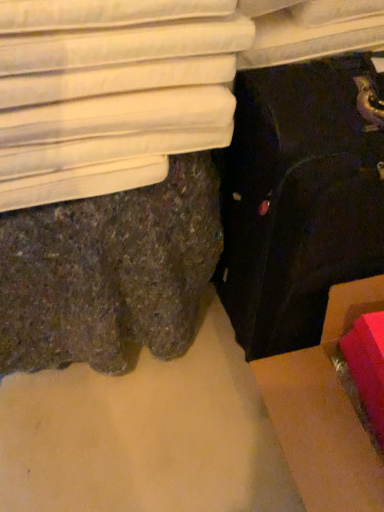
What do you see at coordinates (142, 82) in the screenshot? I see `white fabric bed at upper left` at bounding box center [142, 82].

What are the coordinates of `black fabric suitcase at lower right` in the screenshot? It's located at click(x=298, y=200).

Is white fabric bed at upper left facing away from black fabric suitcase at lower right?

That's not correct — white fabric bed at upper left is not looking away from black fabric suitcase at lower right.

Considering the relative sizes of white fabric bed at upper left and black fabric suitcase at lower right in the image provided, is white fabric bed at upper left smaller than black fabric suitcase at lower right?

Correct, white fabric bed at upper left occupies less space than black fabric suitcase at lower right.

From a real-world perspective, is white fabric bed at upper left above or below black fabric suitcase at lower right?

From a real-world perspective, white fabric bed at upper left is physically above black fabric suitcase at lower right.

Which is behind, white fabric bed at upper left or black fabric suitcase at lower right?

white fabric bed at upper left is more distant.

Based on the photo, is black fabric suitcase at lower right wider or thinner than white fabric bed at upper left?

black fabric suitcase at lower right is thinner than white fabric bed at upper left.

Find the location of a particular element. furniture that is above the black fabric suitcase at lower right (from the image's perspective) is located at coordinates (142, 82).

Consider the image. How different are the orientations of black fabric suitcase at lower right and white fabric bed at upper left in degrees?

The facing directions of black fabric suitcase at lower right and white fabric bed at upper left are 0.618 degrees apart.

Looking at this image, is black fabric suitcase at lower right in front of or behind white fabric bed at upper left in the image?

Clearly, black fabric suitcase at lower right is in front of white fabric bed at upper left.

Based on their sizes in the image, would you say cardboard box at lower right is bigger or smaller than black fabric suitcase at lower right?

In the image, cardboard box at lower right appears to be smaller than black fabric suitcase at lower right.

Which object is further away from the camera, cardboard box at lower right or black fabric suitcase at lower right?

cardboard box at lower right is more distant.

Considering the points (342, 504) and (296, 314), which point is in front, point (342, 504) or point (296, 314)?

The point (342, 504) is closer.

How distant is cardboard box at lower right from black fabric suitcase at lower right?

The distance of cardboard box at lower right from black fabric suitcase at lower right is 8.61 inches.

From the image's perspective, is black fabric suitcase at lower right on cardboard box at lower right?

Correct, black fabric suitcase at lower right appears higher than cardboard box at lower right in the image.

Does black fabric suitcase at lower right have a smaller size compared to cardboard box at lower right?

Incorrect, black fabric suitcase at lower right is not smaller in size than cardboard box at lower right.

From the picture: Would you say black fabric suitcase at lower right is outside cardboard box at lower right?

That's correct, black fabric suitcase at lower right is outside of cardboard box at lower right.

Consider the image. Are black fabric suitcase at lower right and cardboard box at lower right located far from each other?

black fabric suitcase at lower right is actually quite close to cardboard box at lower right.

Measure the distance between white fabric bed at upper left and cardboard box at lower right.

21.90 inches.

Is point (18, 46) positioned in front of point (299, 395)?

Yes.

From the picture: Could you tell me if white fabric bed at upper left is facing cardboard box at lower right?

No, white fabric bed at upper left is not oriented towards cardboard box at lower right.

Between white fabric bed at upper left and cardboard box at lower right, which one has larger width?

Wider between the two is cardboard box at lower right.

Looking at this image, considering the positions of objects cardboard box at lower right and white fabric bed at upper left in the image provided, who is more to the right, cardboard box at lower right or white fabric bed at upper left?

cardboard box at lower right.

Considering the sizes of objects cardboard box at lower right and white fabric bed at upper left in the image provided, who is taller, cardboard box at lower right or white fabric bed at upper left?

With more height is cardboard box at lower right.

Is cardboard box at lower right wider than white fabric bed at upper left?

Yes.

From the image's perspective, which object appears higher, cardboard box at lower right or white fabric bed at upper left?

white fabric bed at upper left appears higher in the image.

Locate an element on the screen. suitcase lying on the right of white fabric bed at upper left is located at coordinates (298, 200).

This screenshot has height=512, width=384. Find the location of `suitcase below the white fabric bed at upper left (from the image's perspective)`. suitcase below the white fabric bed at upper left (from the image's perspective) is located at coordinates (298, 200).

Looking at the image, which one is located further to white fabric bed at upper left, cardboard box at lower right or black fabric suitcase at lower right?

cardboard box at lower right is further to white fabric bed at upper left.

From the image, which object appears to be farther from black fabric suitcase at lower right, white fabric bed at upper left or cardboard box at lower right?

The object further to black fabric suitcase at lower right is white fabric bed at upper left.

Looking at this image, considering their positions, is black fabric suitcase at lower right positioned closer to white fabric bed at upper left than cardboard box at lower right?

black fabric suitcase at lower right is positioned closer to the anchor white fabric bed at upper left.

Looking at this image, looking at the image, which one is located closer to cardboard box at lower right, black fabric suitcase at lower right or white fabric bed at upper left?

black fabric suitcase at lower right is positioned closer to the anchor cardboard box at lower right.

From the image, which object appears to be farther from black fabric suitcase at lower right, cardboard box at lower right or white fabric bed at upper left?

Based on the image, white fabric bed at upper left appears to be further to black fabric suitcase at lower right.

Based on their spatial positions, is white fabric bed at upper left or black fabric suitcase at lower right closer to cardboard box at lower right?

The object closer to cardboard box at lower right is black fabric suitcase at lower right.

This screenshot has height=512, width=384. I want to click on suitcase between white fabric bed at upper left and cardboard box at lower right in the up-down direction, so click(x=298, y=200).